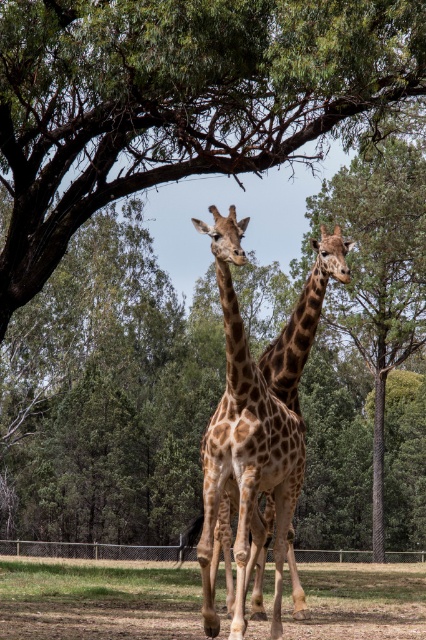
Is green leafy tree at upper center above brown dirt field at lower center?

Yes.

Does green leafy tree at upper center have a lesser height compared to brown dirt field at lower center?

Indeed, green leafy tree at upper center has a lesser height compared to brown dirt field at lower center.

Between point (46, 243) and point (25, 636), which one is positioned in front?

Point (25, 636) is more forward.

You are a GUI agent. You are given a task and a screenshot of the screen. Output one action in this format:
    pyautogui.click(x=<x>, y=<y>)
    Task: Click on the green leafy tree at upper center
    This screenshot has height=640, width=426.
    Given the screenshot: What is the action you would take?
    pyautogui.click(x=176, y=99)

Who is positioned more to the right, brown dirt field at lower center or spotted brown giraffe at center?

spotted brown giraffe at center

Is brown dirt field at lower center behind spotted brown giraffe at center?

That is True.

Image resolution: width=426 pixels, height=640 pixels. I want to click on brown dirt field at lower center, so point(97,600).

You are a GUI agent. You are given a task and a screenshot of the screen. Output one action in this format:
    pyautogui.click(x=<x>, y=<y>)
    Task: Click on the brown dirt field at lower center
    
    Given the screenshot: What is the action you would take?
    pyautogui.click(x=97, y=600)

Does green leafy tree at upper center have a greater width compared to spotted brown giraffe at center?

Yes, green leafy tree at upper center is wider than spotted brown giraffe at center.

Is point (365, 65) positioned behind point (275, 579)?

Yes.

Image resolution: width=426 pixels, height=640 pixels. In order to click on green leafy tree at upper center in this screenshot , I will do `click(176, 99)`.